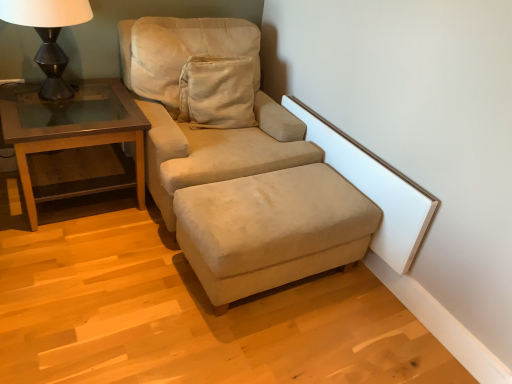
Where is `free point in front of brown wood/glass table at left`? free point in front of brown wood/glass table at left is located at coordinates (70, 261).